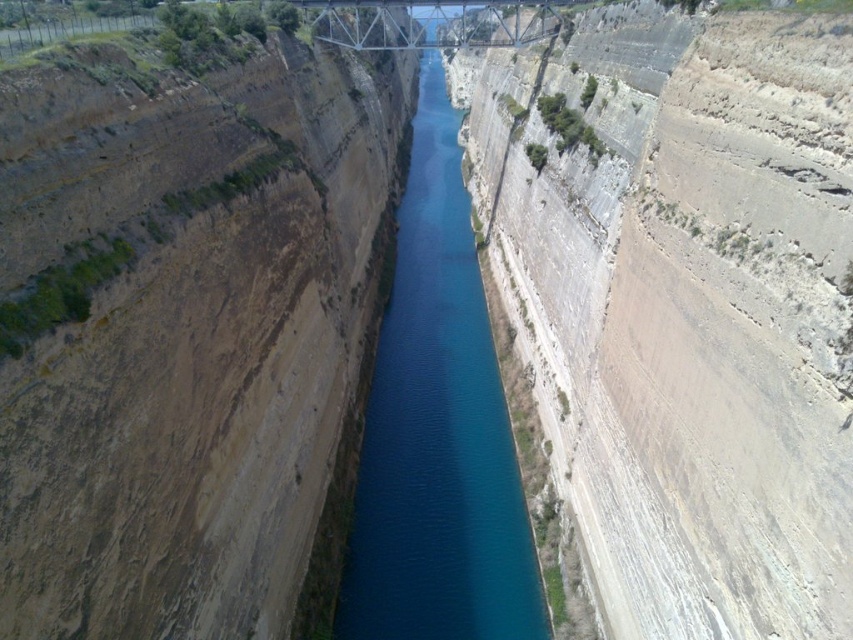
Based on the photo, can you confirm if brown rocky cliff at left is taller than metallic steel bridge at upper center?

Incorrect, brown rocky cliff at left's height is not larger of metallic steel bridge at upper center's.

The image size is (853, 640). Describe the element at coordinates (184, 326) in the screenshot. I see `brown rocky cliff at left` at that location.

At what (x,y) coordinates should I click in order to perform the action: click on brown rocky cliff at left. Please return your answer as a coordinate pair (x, y). The height and width of the screenshot is (640, 853). Looking at the image, I should click on (184, 326).

Which is behind, point (463, 628) or point (409, 4)?

The point (409, 4) is more distant.

Find the location of a particular element. blue smooth water at center is located at coordinates pyautogui.click(x=437, y=429).

This screenshot has height=640, width=853. What do you see at coordinates (184, 326) in the screenshot?
I see `brown rocky cliff at left` at bounding box center [184, 326].

Does brown rocky cliff at left appear on the right side of blue smooth water at center?

In fact, brown rocky cliff at left is to the left of blue smooth water at center.

Which is in front, point (67, 268) or point (396, 376)?

Point (67, 268)

Locate an element on the screen. brown rocky cliff at left is located at coordinates (184, 326).